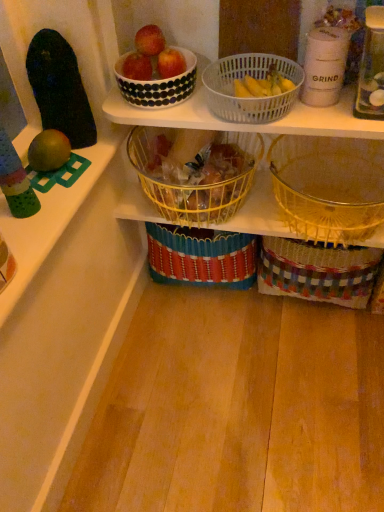
Describe the element at coordinates (158, 84) in the screenshot. I see `white dotted bowl at upper center` at that location.

Locate an element on the screen. The image size is (384, 512). matte black bowl at upper center, positioned as the 1th apple in left-to-right order is located at coordinates (137, 67).

The image size is (384, 512). What do you see at coordinates (371, 68) in the screenshot?
I see `transparent plastic bottle at upper right` at bounding box center [371, 68].

Measure the distance between translucent plastic basket at upper center, the second basket viewed from the right, and camera.

A distance of 90.08 centimeters exists between translucent plastic basket at upper center, the second basket viewed from the right, and camera.

This screenshot has height=512, width=384. What are the coordinates of `yellow woven basket at lower right, placed as the first basket when sorted from right to left` in the screenshot? It's located at (329, 186).

In order to face yellow woven basket at lower right, placed as the first basket when sorted from right to left, should I rotate leftwards or rightwards?

You should rotate right by 18.193 degrees.

The width and height of the screenshot is (384, 512). Find the location of `white dotted bowl at upper center`. white dotted bowl at upper center is located at coordinates (158, 84).

Considering the relative positions of yellow woven basket at lower right, placed as the first basket when sorted from right to left, and woven multicolored basket at lower right in the image provided, is yellow woven basket at lower right, placed as the first basket when sorted from right to left, to the left or to the right of woven multicolored basket at lower right?

In the image, yellow woven basket at lower right, placed as the first basket when sorted from right to left, appears on the left side of woven multicolored basket at lower right.

Can you confirm if yellow woven basket at lower right, placed as the first basket when sorted from right to left, is taller than woven multicolored basket at lower right?

In fact, yellow woven basket at lower right, placed as the first basket when sorted from right to left, may be shorter than woven multicolored basket at lower right.

Considering the positions of point (322, 160) and point (347, 257), is point (322, 160) closer or farther from the camera than point (347, 257)?

Point (322, 160) is positioned farther from the camera compared to point (347, 257).

Is yellow woven basket at lower right, placed as the first basket when sorted from right to left, looking in the opposite direction of woven multicolored basket at lower right?

That's not correct — yellow woven basket at lower right, placed as the first basket when sorted from right to left, is not looking away from woven multicolored basket at lower right.

From a real-world perspective, who is located lower, glossy apple at upper center, marked as the 3th apple in a left-to-right arrangement, or woven multicolored basket at lower right?

In real-world perspective, woven multicolored basket at lower right is lower.

Is glossy apple at upper center, marked as the 3th apple in a left-to-right arrangement, facing away from woven multicolored basket at lower right?

No, glossy apple at upper center, marked as the 3th apple in a left-to-right arrangement,'s orientation is not away from woven multicolored basket at lower right.

Identify the location of the 1st apple in front of the woven multicolored basket at lower right, counting from the anchor's position. The height and width of the screenshot is (512, 384). (170, 63).

The height and width of the screenshot is (512, 384). I want to click on gift basket that appears below the yellow woven basket at lower right, arranged as the 3th basket when viewed from the left (from a real-world perspective), so click(317, 271).

Is woven multicolored basket at lower right taller or shorter than yellow woven basket at lower right, placed as the first basket when sorted from right to left?

Considering their sizes, woven multicolored basket at lower right has more height than yellow woven basket at lower right, placed as the first basket when sorted from right to left.

From a real-world perspective, which object stands above the other?

yellow woven basket at lower right, placed as the first basket when sorted from right to left, from a real-world perspective.

How many degrees apart are the facing directions of woven multicolored basket at lower right and yellow woven basket at lower right, arranged as the 3th basket when viewed from the left?

They differ by 0.00393 degrees in their facing directions.

Would you consider woven multicolored basket at lower right to be distant from translucent plastic basket at upper center, the second basket viewed from the right?

woven multicolored basket at lower right is actually quite close to translucent plastic basket at upper center, the second basket viewed from the right.

Between woven multicolored basket at lower right and translucent plastic basket at upper center, which appears as the second basket when viewed from the left, which one is positioned in front?

translucent plastic basket at upper center, which appears as the second basket when viewed from the left, is closer to the camera.

Identify the location of basket that is the 3rd object located above the woven multicolored basket at lower right (from the image's perspective). [x=249, y=98].

Between woven multicolored basket at lower right and translucent plastic basket at upper center, which appears as the second basket when viewed from the left, which one has larger width?

woven multicolored basket at lower right is wider.

From a real-world perspective, is glossy apple at upper center, marked as the 3th apple in a left-to-right arrangement, on top of yellow wire basket at center, marked as the third basket in a right-to-left arrangement?

Indeed, from a real-world perspective, glossy apple at upper center, marked as the 3th apple in a left-to-right arrangement, stands above yellow wire basket at center, marked as the third basket in a right-to-left arrangement.

Between glossy apple at upper center, marked as the 3th apple in a left-to-right arrangement, and yellow wire basket at center, positioned as the first basket in left-to-right order, which one has more height?

Standing taller between the two is yellow wire basket at center, positioned as the first basket in left-to-right order.

Which of these two, glossy apple at upper center, marked as the 3th apple in a left-to-right arrangement, or yellow wire basket at center, marked as the third basket in a right-to-left arrangement, is thinner?

With smaller width is glossy apple at upper center, marked as the 3th apple in a left-to-right arrangement.

In the scene shown: From the image's perspective, which one is positioned higher, glossy apple at upper center, acting as the first apple starting from the right, or yellow wire basket at center, positioned as the first basket in left-to-right order?

glossy apple at upper center, acting as the first apple starting from the right, appears higher in the image.

Is glossy apple at upper center, acting as the first apple starting from the right, surrounded by transparent plastic bottle at upper right?

No, glossy apple at upper center, acting as the first apple starting from the right, is not inside transparent plastic bottle at upper right.

Find the location of a particular element. Image resolution: width=384 pixels, height=512 pixels. bottle on the right of glossy apple at upper center, marked as the 3th apple in a left-to-right arrangement is located at coordinates (371, 68).

From the image's perspective, is transparent plastic bottle at upper right located above glossy apple at upper center, acting as the first apple starting from the right?

No, from the image's perspective, transparent plastic bottle at upper right is not on top of glossy apple at upper center, acting as the first apple starting from the right.

Consider the image. Would you say yellow plastic bananas at upper center is outside glossy apple at upper center, marked as the 3th apple in a left-to-right arrangement?

Yes, yellow plastic bananas at upper center is located beyond the bounds of glossy apple at upper center, marked as the 3th apple in a left-to-right arrangement.

Locate an element on the screen. The height and width of the screenshot is (512, 384). the 3rd apple behind the yellow plastic bananas at upper center, counting from the anchor's position is located at coordinates (170, 63).

Is yellow plastic bananas at upper center to the left or to the right of glossy apple at upper center, acting as the first apple starting from the right, in the image?

From the image, it's evident that yellow plastic bananas at upper center is to the right of glossy apple at upper center, acting as the first apple starting from the right.

Find the location of a particular element. The width and height of the screenshot is (384, 512). basket that is the 2nd one above the woven multicolored basket at lower right (from a real-world perspective) is located at coordinates (329, 186).

In the image, there is a glossy apple at upper center, marked as the 3th apple in a left-to-right arrangement. Find the location of `gift basket below it (from the image's perspective)`. gift basket below it (from the image's perspective) is located at coordinates (317, 271).

From the picture: Considering their positions, is woven multicolored basket at lower right positioned further to matte black bowl at upper center, which appears as the 3th apple when viewed from the right, than white dotted bowl at upper center?

Based on the image, woven multicolored basket at lower right appears to be further to matte black bowl at upper center, which appears as the 3th apple when viewed from the right.

When comparing their distances from white dotted bowl at upper center, does yellow wire basket at center, marked as the third basket in a right-to-left arrangement, or yellow plastic bananas at upper center seem closer?

yellow plastic bananas at upper center lies closer to white dotted bowl at upper center than the other object.

From the picture: When comparing their distances from matte black bowl at upper center, which appears as the 3th apple when viewed from the right, does woven multicolored basket at lower right or yellow plastic bananas at upper center seem closer?

Among the two, yellow plastic bananas at upper center is located nearer to matte black bowl at upper center, which appears as the 3th apple when viewed from the right.

From the image, which object appears to be farther from woven multicolored basket at lower right, yellow wire basket at center, positioned as the first basket in left-to-right order, or shiny red apple at upper center, the second apple when ordered from left to right?

Among the two, shiny red apple at upper center, the second apple when ordered from left to right, is located further to woven multicolored basket at lower right.

Which object lies further to the anchor point transparent plastic bottle at upper right, woven multicolored basket at lower right or yellow woven basket at lower right, placed as the first basket when sorted from right to left?

Based on the image, woven multicolored basket at lower right appears to be further to transparent plastic bottle at upper right.

Which object lies nearer to the anchor point glossy apple at upper center, marked as the 3th apple in a left-to-right arrangement, shiny red apple at upper center, the second apple when ordered from left to right, or matte black bowl at upper center, positioned as the 1th apple in left-to-right order?

The object closer to glossy apple at upper center, marked as the 3th apple in a left-to-right arrangement, is shiny red apple at upper center, the second apple when ordered from left to right.

When comparing their distances from white dotted bowl at upper center, does translucent plastic basket at upper center, which appears as the second basket when viewed from the left, or matte black bowl at upper center, positioned as the 1th apple in left-to-right order, seem closer?

matte black bowl at upper center, positioned as the 1th apple in left-to-right order, is positioned closer to the anchor white dotted bowl at upper center.

Based on their spatial positions, is shiny red apple at upper center, the 2th apple when ordered from right to left, or matte black bowl at upper center, positioned as the 1th apple in left-to-right order, further from woven multicolored basket at lower right?

shiny red apple at upper center, the 2th apple when ordered from right to left.

Image resolution: width=384 pixels, height=512 pixels. I want to click on bowl between matte black bowl at upper center, positioned as the 1th apple in left-to-right order, and yellow plastic bananas at upper center from left to right, so click(x=158, y=84).

At what (x,y) coordinates should I click in order to perform the action: click on bowl between shiny red apple at upper center, the 2th apple when ordered from right to left, and woven multicolored basket at lower right. Please return your answer as a coordinate pair (x, y). This screenshot has width=384, height=512. Looking at the image, I should click on (158, 84).

The width and height of the screenshot is (384, 512). I want to click on bowl between shiny red apple at upper center, the 2th apple when ordered from right to left, and transparent plastic bottle at upper right, so click(x=158, y=84).

Locate an element on the screen. This screenshot has width=384, height=512. bowl between matte black bowl at upper center, positioned as the 1th apple in left-to-right order, and transparent plastic bottle at upper right, in the horizontal direction is located at coordinates (158, 84).